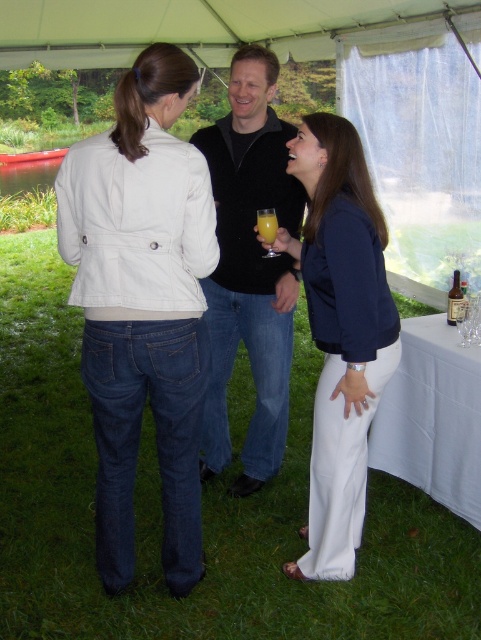
Looking at this image, which is more to the left, white matte jacket at center or translucent glass at center?

From the viewer's perspective, white matte jacket at center appears more on the left side.

Between white matte jacket at center and translucent glass at center, which one has less height?

translucent glass at center

What do you see at coordinates (142, 305) in the screenshot? This screenshot has width=481, height=640. I see `white matte jacket at center` at bounding box center [142, 305].

This screenshot has width=481, height=640. I want to click on white matte jacket at center, so click(142, 305).

Does white matte jacket at center have a greater height compared to matte blue jacket at center?

Correct, white matte jacket at center is much taller as matte blue jacket at center.

Does point (92, 186) lie behind point (325, 579)?

That is False.

Is point (198, 253) positioned in front of point (311, 214)?

That is True.

The height and width of the screenshot is (640, 481). Find the location of `white matte jacket at center`. white matte jacket at center is located at coordinates 142,305.

Is point (321, 532) closer to viewer compared to point (448, 308)?

Yes.

Which is more to the left, matte blue jacket at center or brown glass bottle at lower right?

matte blue jacket at center

Where is `matte blue jacket at center`? The image size is (481, 640). matte blue jacket at center is located at coordinates (341, 333).